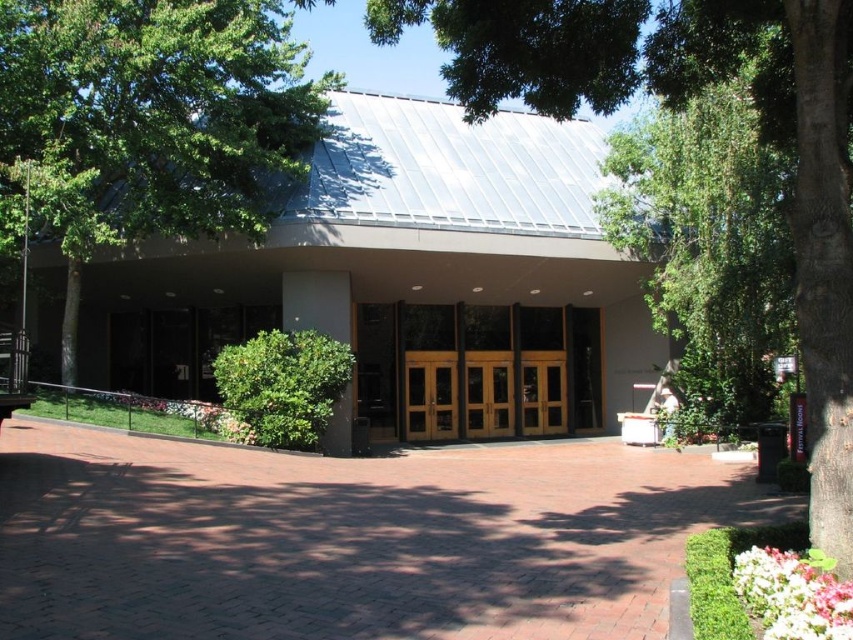
Question: Considering the relative positions of green leafy tree at center and green leafy tree at upper center in the image provided, where is green leafy tree at center located with respect to green leafy tree at upper center?

Choices:
 (A) right
 (B) left

Answer: (B)

Question: Which is nearer to the green leafy tree at upper center?

Choices:
 (A) green leafy tree at center
 (B) green leafy tree at upper left

Answer: (A)

Question: Is green leafy tree at upper left above green leafy tree at center?

Choices:
 (A) yes
 (B) no

Answer: (A)

Question: Does green leafy tree at center have a larger size compared to green leafy tree at upper center?

Choices:
 (A) yes
 (B) no

Answer: (B)

Question: Which of these objects is positioned closest to the green leafy tree at center?

Choices:
 (A) green leafy tree at upper center
 (B) green leafy tree at upper left

Answer: (A)

Question: Which point is closer to the camera?

Choices:
 (A) green leafy tree at upper center
 (B) green leafy tree at center
 (C) green leafy tree at upper left

Answer: (B)